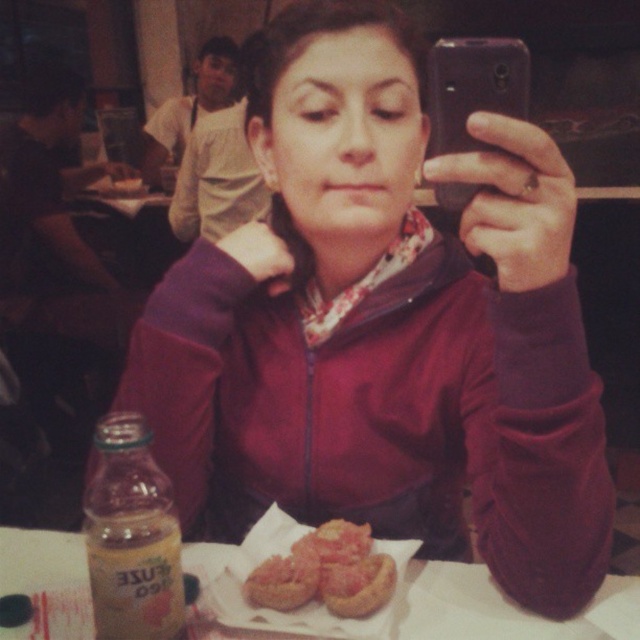
Question: Estimate the real-world distances between objects in this image. Which object is farther from the pinkish-brown bread at center?

Choices:
 (A) golden crispy bread at center
 (B) golden brown bread at lower center
 (C) black plastic phone at upper center

Answer: (C)

Question: Can you confirm if golden brown bread at lower center is thinner than pinkish-brown bread at center?

Choices:
 (A) no
 (B) yes

Answer: (B)

Question: Among these objects, which one is farthest from the camera?

Choices:
 (A) white paper plate at lower center
 (B) golden brown bread at lower center
 (C) golden crispy bread at center

Answer: (C)

Question: Is black plastic phone at upper center wider than golden crispy bread at center?

Choices:
 (A) no
 (B) yes

Answer: (A)

Question: Is golden crispy bread at center positioned behind pinkish-brown bread at center?

Choices:
 (A) no
 (B) yes

Answer: (A)

Question: Which object is farther from the camera taking this photo?

Choices:
 (A) golden brown bread at lower center
 (B) pinkish-brown bread at center

Answer: (B)